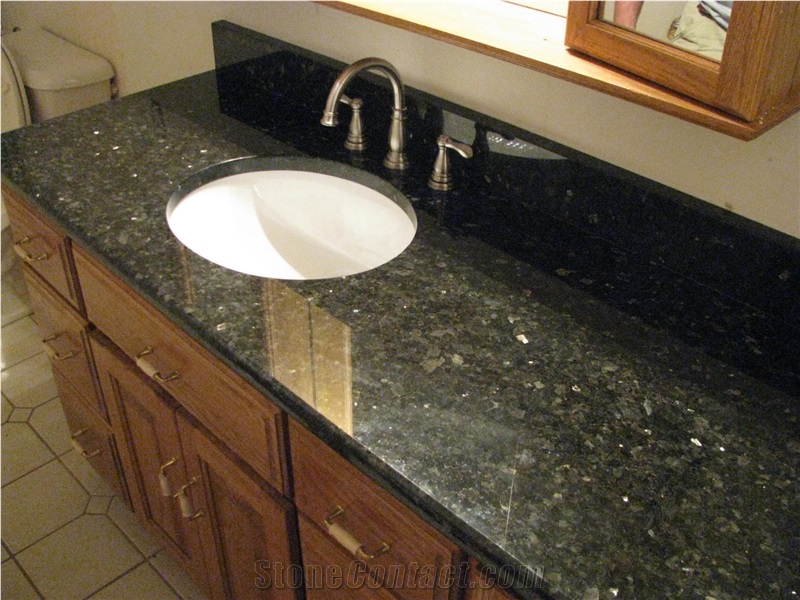
The width and height of the screenshot is (800, 600). What are the coordinates of `beige floor` in the screenshot? It's located at (93, 547).